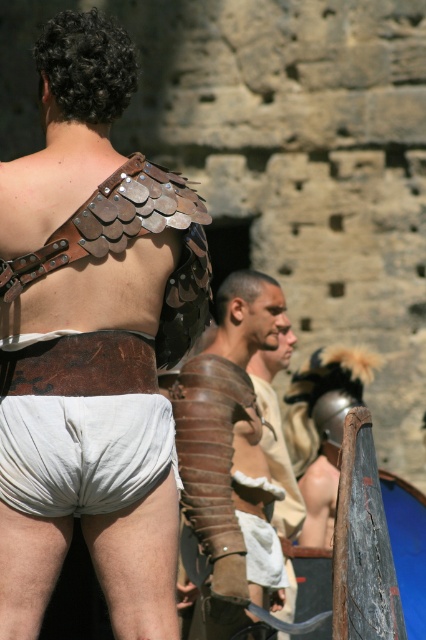
Does leather/scaly armor at back have a lesser height compared to brown leather armor at center?

In fact, leather/scaly armor at back may be taller than brown leather armor at center.

Does leather/scaly armor at back have a smaller size compared to brown leather armor at center?

Yes.

Identify the location of leather/scaly armor at back. (92, 340).

Image resolution: width=426 pixels, height=640 pixels. What are the coordinates of `leather/scaly armor at back` in the screenshot? It's located at (92, 340).

Is brown leather armor at center shorter than white cotton shorts at lower center?

No.

Find the location of a particular element. The height and width of the screenshot is (640, 426). brown leather armor at center is located at coordinates (230, 452).

Is leather/scaly armor at back positioned at the back of white cotton shorts at lower center?

No, leather/scaly armor at back is in front of white cotton shorts at lower center.

At what (x,y) coordinates should I click in order to perform the action: click on leather/scaly armor at back. Please return your answer as a coordinate pair (x, y). This screenshot has height=640, width=426. Looking at the image, I should click on (92, 340).

You are a GUI agent. You are given a task and a screenshot of the screen. Output one action in this format:
    pyautogui.click(x=<x>, y=<y>)
    Task: Click on the leather/scaly armor at back
    
    Given the screenshot: What is the action you would take?
    pyautogui.click(x=92, y=340)